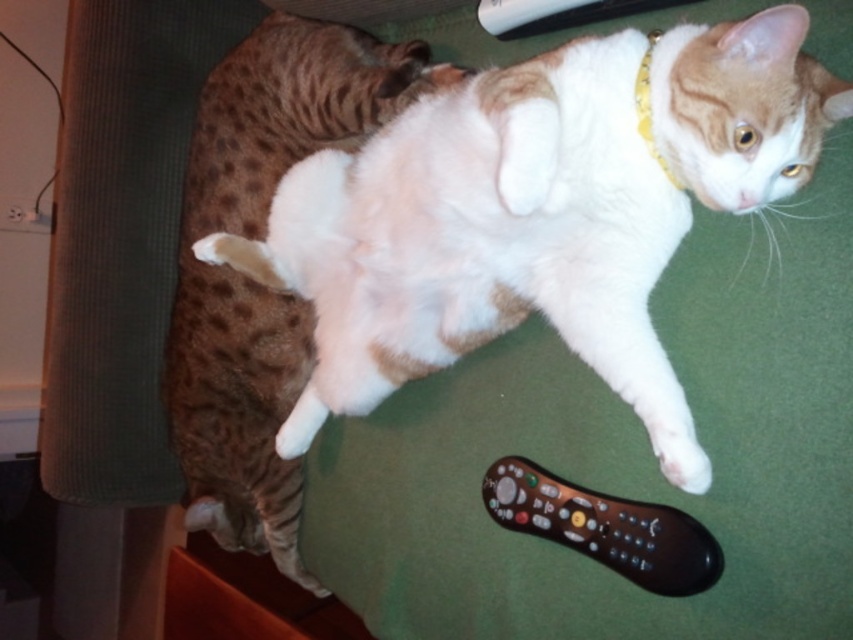
You are a cat owner who wants to buy a new cat bed. The current bed is only suitable for small cats. Which cat between the white fur cat at center and the tabby fur cat at left would need a bigger bed?

The white fur cat at center needs a bigger bed since it has a larger size compared to the tabby fur cat at left.

You are a cat owner who wants to buy a new blanket for your cats. The blanket needs to cover both cats simultaneously. Given that the white fur cat at center is wider than the tabby fur cat at left, what should be the minimum width of the blanket to ensure both cats are fully covered?

The minimum width of the blanket should be at least the width of the white fur cat at center since it is wider than the tabby fur cat at left. This ensures both cats are fully covered.